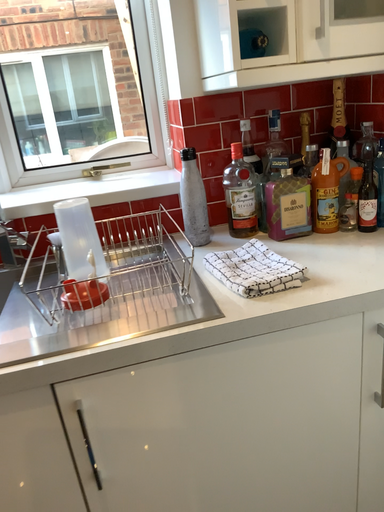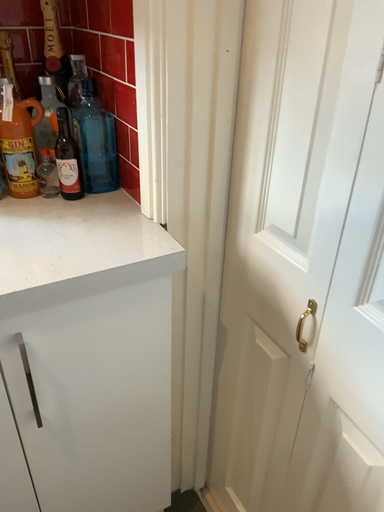
Question: How did the camera likely rotate when shooting the video?

Choices:
 (A) rotated downward
 (B) rotated upward

Answer: (A)